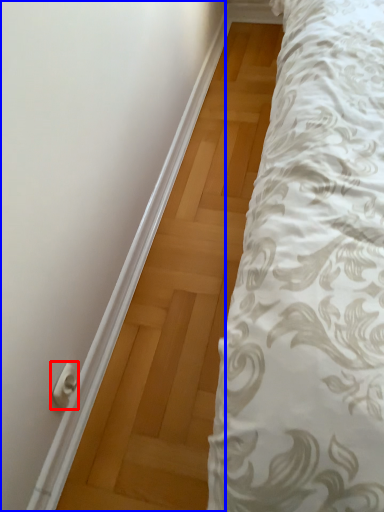
Question: Which of the following is the closest to the observer, door handle (highlighted by a red box) or door (highlighted by a blue box)?

Choices:
 (A) door handle
 (B) door

Answer: (B)